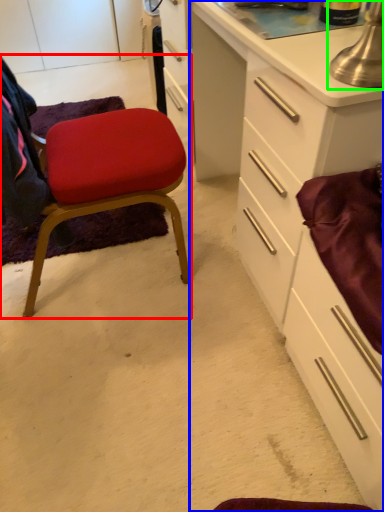
Question: Which is farther away from chair (highlighted by a red box)? cabinetry (highlighted by a blue box) or table lamp (highlighted by a green box)?

Choices:
 (A) cabinetry
 (B) table lamp

Answer: (B)